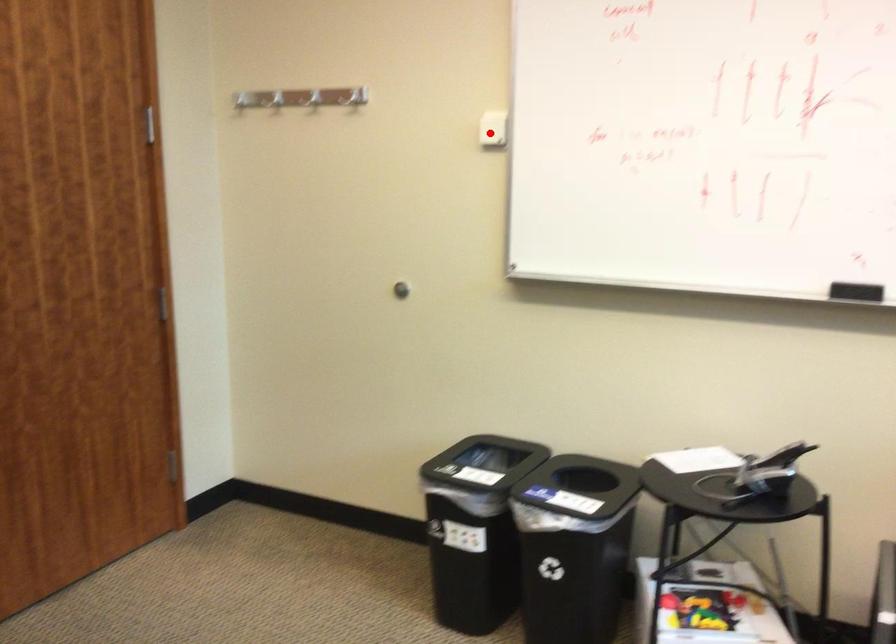
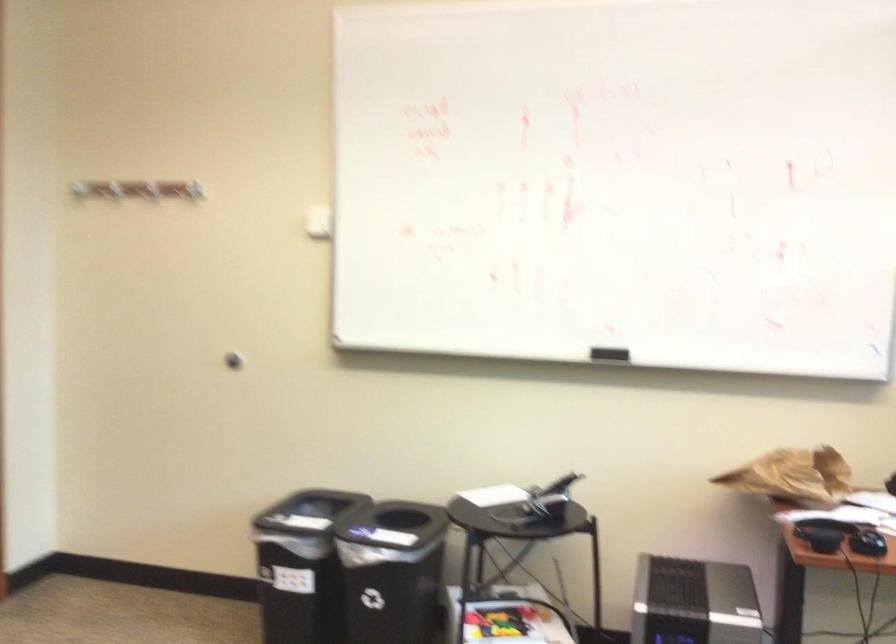
In the second image, find the point that corresponds to the highlighted location in the first image.

(317, 222)